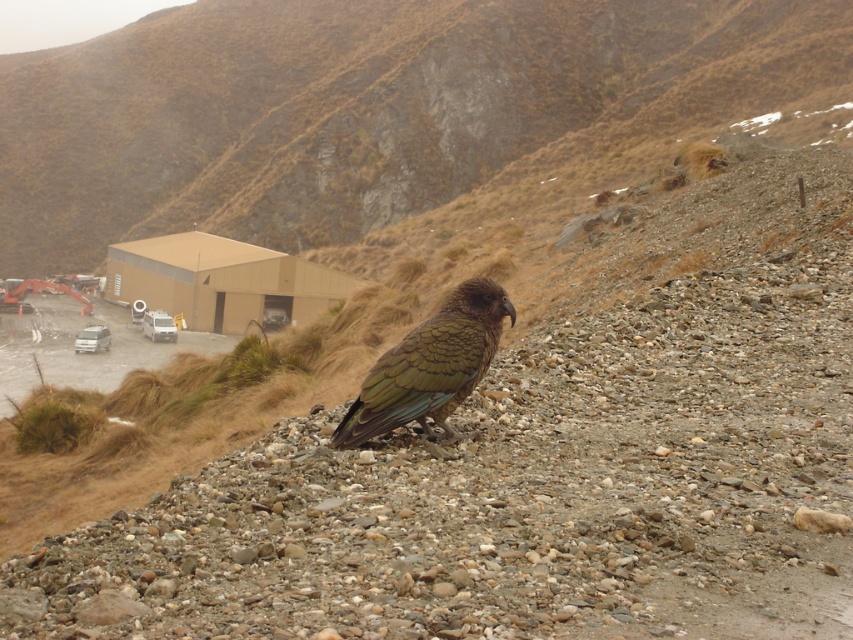
Question: Which of the following is the closest to the observer?

Choices:
 (A) brown grassy hillside at upper center
 (B) green feathered bird at center
 (C) silver metallic van at left

Answer: (B)

Question: Does brown grassy hillside at upper center have a smaller size compared to green feathered bird at center?

Choices:
 (A) yes
 (B) no

Answer: (B)

Question: Which of these objects is positioned farthest from the brown grassy hillside at upper center?

Choices:
 (A) brown gravel at center
 (B) green feathered bird at center

Answer: (A)

Question: Which of the following is the farthest from the observer?

Choices:
 (A) brown grassy hillside at upper center
 (B) green feathered bird at center
 (C) brown gravel at center
 (D) silver metallic van at left

Answer: (A)

Question: In this image, where is green feathered bird at center located relative to silver metallic van at left?

Choices:
 (A) below
 (B) above

Answer: (B)

Question: Is brown grassy hillside at upper center to the left of green feathered bird at center from the viewer's perspective?

Choices:
 (A) no
 (B) yes

Answer: (B)